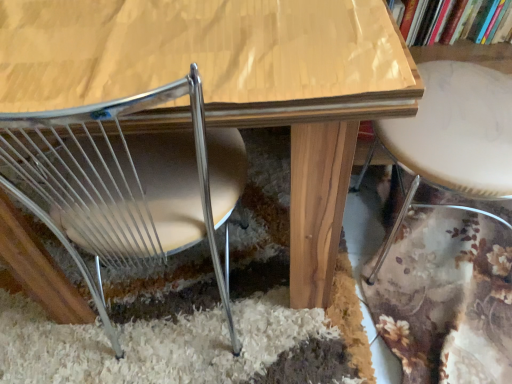
Question: Based on their positions, is white marble bar stool at right located to the left or right of hardcover book at upper right?

Choices:
 (A) right
 (B) left

Answer: (A)

Question: From a real-world perspective, relative to hardcover book at upper right, is white marble bar stool at right vertically above or below?

Choices:
 (A) above
 (B) below

Answer: (B)

Question: Based on their relative distances, which object is nearer to the white marble bar stool at right?

Choices:
 (A) hardcover book at upper right
 (B) wooden table at center
 (C) metallic wire chair at lower left

Answer: (A)

Question: Considering the real-world distances, which object is closest to the hardcover book at upper right?

Choices:
 (A) metallic wire chair at lower left
 (B) wooden table at center
 (C) white marble bar stool at right

Answer: (C)